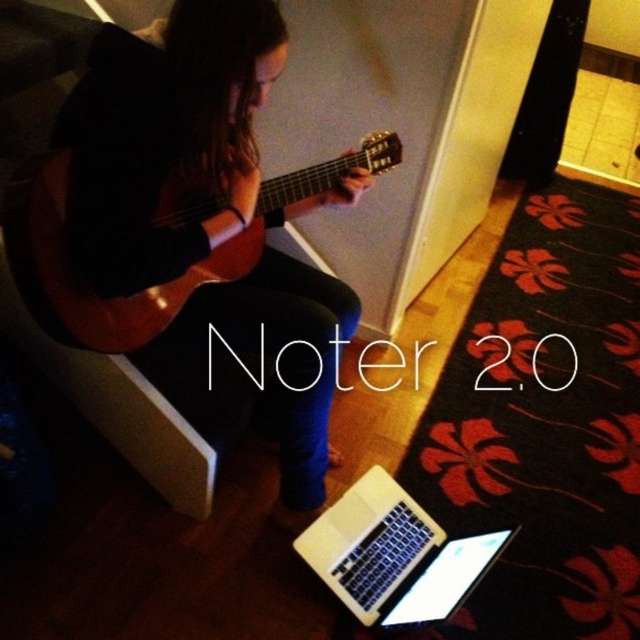
Question: Considering the real-world distances, which object is farthest from the wooden acoustic guitar at center?

Choices:
 (A) matte black guitar at center
 (B) white glossy laptop at lower center

Answer: (B)

Question: Which object is positioned closest to the white glossy laptop at lower center?

Choices:
 (A) matte black guitar at center
 (B) wooden acoustic guitar at center

Answer: (A)

Question: Does matte black guitar at center have a greater width compared to white glossy laptop at lower center?

Choices:
 (A) no
 (B) yes

Answer: (B)

Question: In this image, where is matte black guitar at center located relative to wooden acoustic guitar at center?

Choices:
 (A) below
 (B) above

Answer: (A)

Question: Observing the image, what is the correct spatial positioning of matte black guitar at center in reference to white glossy laptop at lower center?

Choices:
 (A) below
 (B) above

Answer: (B)

Question: Which point appears farthest from the camera in this image?

Choices:
 (A) (163, 218)
 (B) (445, 595)

Answer: (B)